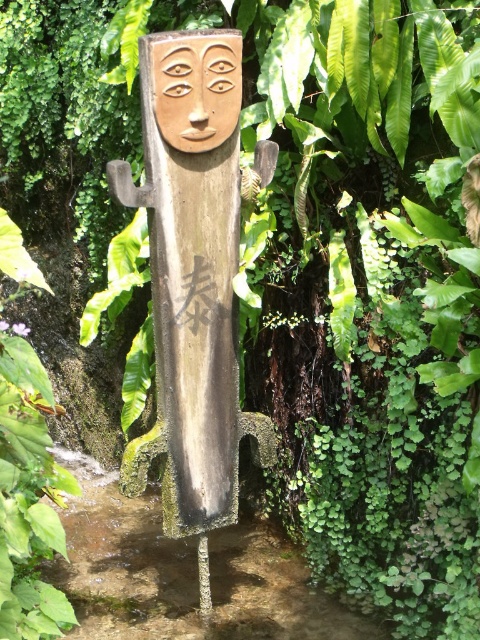
Is wooden carving at center bigger than matte wood mask at upper center?

Yes.

Is point (170, 419) behind point (180, 100)?

Yes, point (170, 419) is behind point (180, 100).

Is point (187, 195) farther from viewer compared to point (188, 136)?

Yes, point (187, 195) is behind point (188, 136).

Find the location of a particular element. The image size is (480, 640). wooden carving at center is located at coordinates (193, 276).